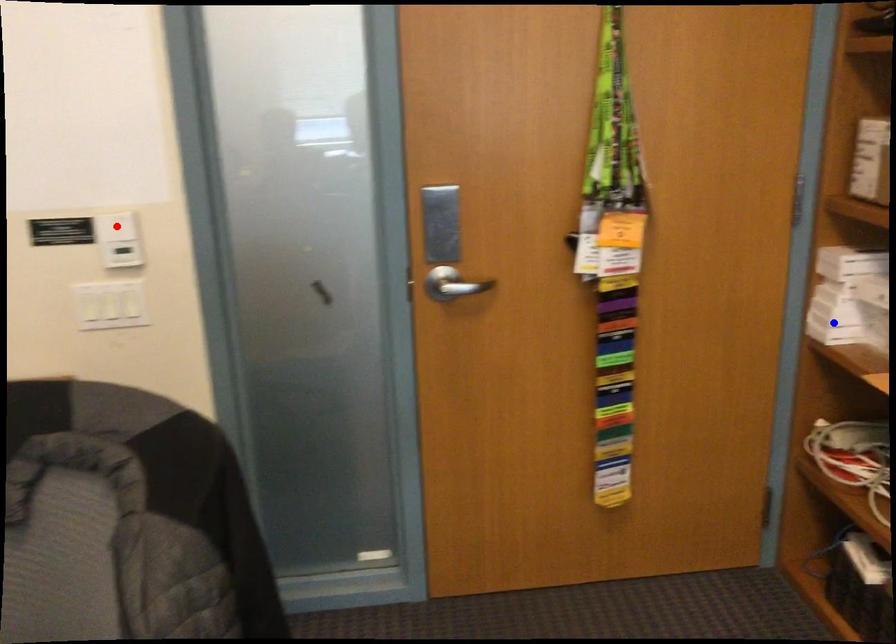
Question: In the image, two points are highlighted. Which point is nearer to the camera? Reply with the corresponding letter.

Choices:
 (A) blue point
 (B) red point

Answer: (B)